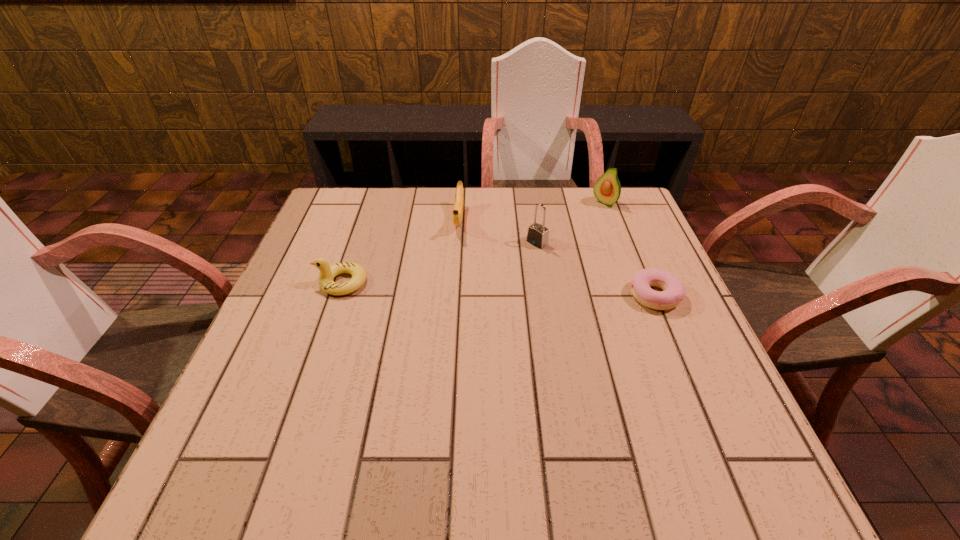
Where is `object that is the third closest to the padlock`? This screenshot has width=960, height=540. object that is the third closest to the padlock is located at coordinates (607, 189).

This screenshot has width=960, height=540. Find the location of `vacant point that satisfies the following two spatial constraints: 1. on the front side of the avocado; 2. on the right side of the doughnut`. vacant point that satisfies the following two spatial constraints: 1. on the front side of the avocado; 2. on the right side of the doughnut is located at coordinates (640, 295).